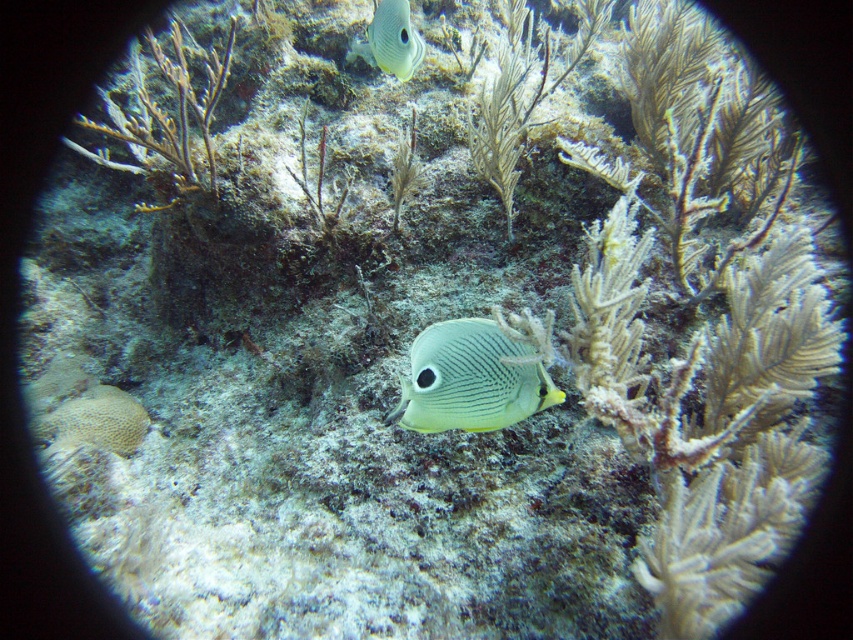
Question: Does translucent yellow fish at center have a greater width compared to translucent white fish at center?

Choices:
 (A) yes
 (B) no

Answer: (A)

Question: In this image, where is translucent yellow fish at center located relative to translucent white fish at center?

Choices:
 (A) left
 (B) right

Answer: (B)

Question: Which point is closer to the camera?

Choices:
 (A) (381, 49)
 (B) (466, 380)

Answer: (B)

Question: Does translucent yellow fish at center appear on the right side of translucent white fish at center?

Choices:
 (A) no
 (B) yes

Answer: (B)

Question: Which object appears farthest from the camera in this image?

Choices:
 (A) translucent yellow fish at center
 (B) translucent white fish at center

Answer: (B)